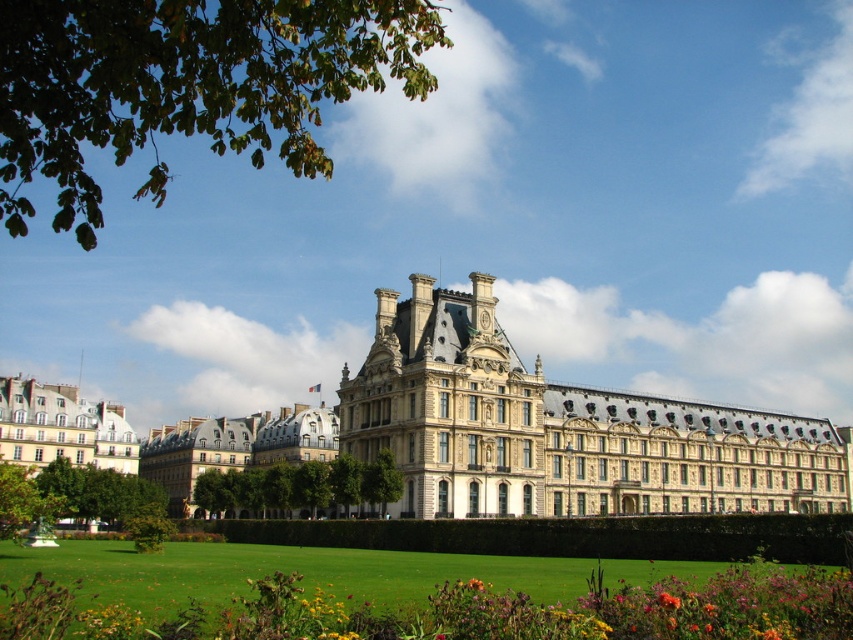
Question: Can you confirm if green grass at lower center is thinner than orange matte flower at lower right?

Choices:
 (A) yes
 (B) no

Answer: (B)

Question: Which of the following is the closest to the observer?

Choices:
 (A) (437, 38)
 (B) (469, 584)

Answer: (A)

Question: Is green leafy tree at upper left further to the viewer compared to yellow matte flower at lower center?

Choices:
 (A) yes
 (B) no

Answer: (B)

Question: Which of these objects is positioned closest to the green leafy tree at lower left?

Choices:
 (A) beige stone building at center
 (B) green leafy tree at upper left

Answer: (A)

Question: Which point appears farthest from the camera in this image?

Choices:
 (A) (16, 490)
 (B) (663, 468)
 (C) (480, 588)
 (D) (270, 490)

Answer: (B)

Question: Can you confirm if green leafy tree at center is positioned to the right of green leafy tree at lower left?

Choices:
 (A) yes
 (B) no

Answer: (A)